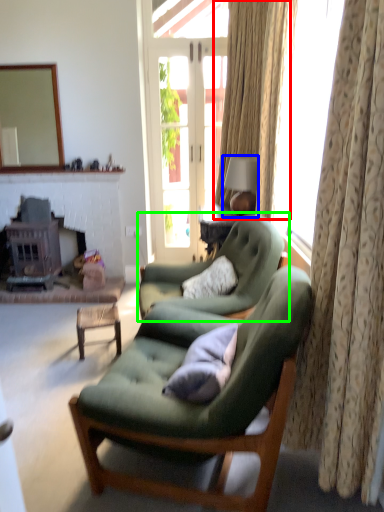
Question: Which object is positioned closest to curtain (highlighted by a red box)? Select from lamp (highlighted by a blue box) and chair (highlighted by a green box).

Choices:
 (A) lamp
 (B) chair

Answer: (A)